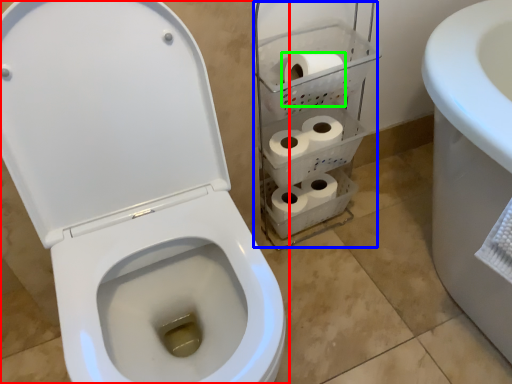
Question: Based on their relative distances, which object is farther from toilet (highlighted by a red box)? Choose from shelf (highlighted by a blue box) and to paper (highlighted by a green box).

Choices:
 (A) shelf
 (B) to paper

Answer: (B)